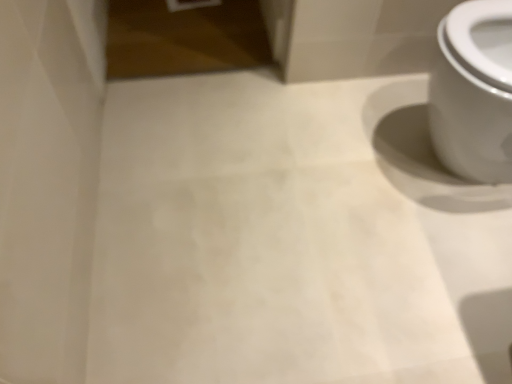
Describe the element at coordinates (472, 97) in the screenshot. I see `white glossy toilet at right` at that location.

Based on the photo, measure the distance between point (454, 35) and camera.

Point (454, 35) is 1.03 meters from camera.

The image size is (512, 384). I want to click on white glossy toilet at right, so click(472, 97).

Where is `white glossy toilet at right`? white glossy toilet at right is located at coordinates (472, 97).